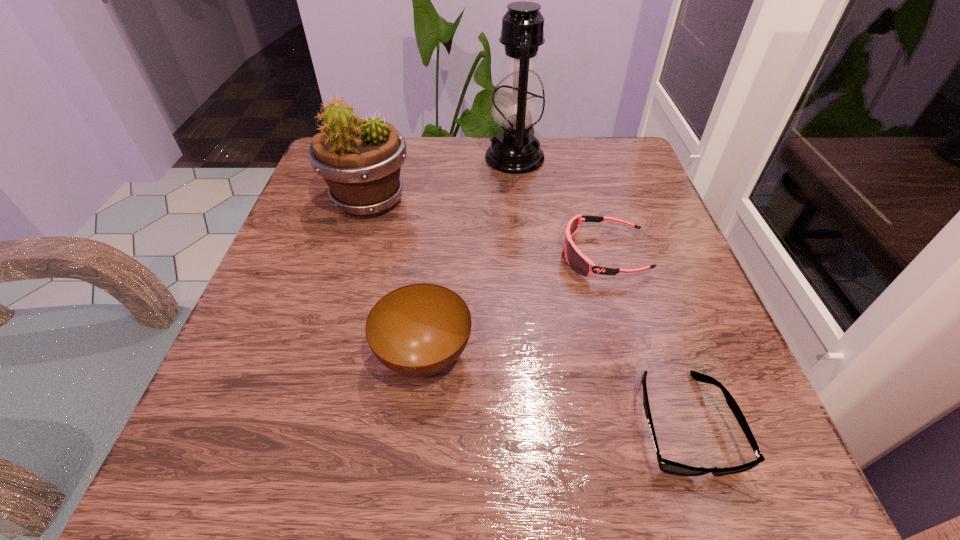
Locate an element on the screen. This screenshot has width=960, height=540. oil lamp is located at coordinates (x=518, y=104).

In order to click on flowerpot in this screenshot , I will do `click(360, 160)`.

Identify the location of the third shortest object. click(x=418, y=330).

This screenshot has height=540, width=960. What are the coordinates of `goggles` in the screenshot? It's located at (576, 259).

What are the coordinates of `the third farthest object` in the screenshot? It's located at (576, 259).

Identify the location of sunglasses. (667, 466).

At what (x,y) coordinates should I click in order to perform the action: click on vacant space located on the left of the oil lamp. Please return your answer as a coordinate pair (x, y). Image resolution: width=960 pixels, height=540 pixels. Looking at the image, I should click on (435, 158).

You are a GUI agent. You are given a task and a screenshot of the screen. Output one action in this format:
    pyautogui.click(x=<x>, y=<y>)
    Task: Click on the vacant space located 0.090m on the front of the flowerpot
    The image size is (960, 540).
    Given the screenshot: What is the action you would take?
    pyautogui.click(x=351, y=260)

In order to click on vacant position located 0.350m on the back of the third shortest object in this screenshot , I will do `click(442, 192)`.

Image resolution: width=960 pixels, height=540 pixels. In order to click on vacant space located 0.140m on the front-facing side of the third nearest object in this screenshot , I will do `click(487, 255)`.